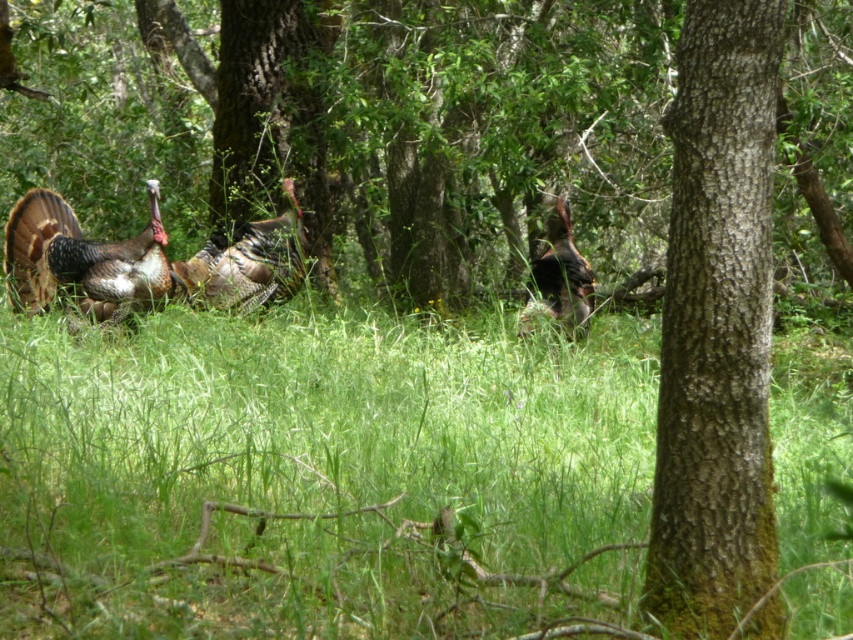
You are a nature photographer aiming to capture the shiny brown turkey at left in the center of your photo. Given its current position at point 0.406 on the x and 0.096 on the y axis, will you need to adjust your camera to the left or right to center it?

The shiny brown turkey at left is positioned at point 0.406 on the x axis and 0.096 on the y axis. To center it in the photo, you would need to adjust the camera to the right, as the x coordinate is less than 0.5, indicating it is to the left of the center. The y coordinate is also below the center, so you might need to adjust upwards slightly as well.

You are a hiker trying to take a photo of the shiny metallic turkey at center. However, the green rough bark tree at center is blocking your view. Can you move around to the left or right to get a clear shot?

The green rough bark tree at center is in front of the shiny metallic turkey at center, so moving to the left or right might allow you to see around the tree and get a clear view of the shiny metallic turkey at center.

You are a photographer standing in the forest scene with the shiny brown turkey at left. You want to take a photo of the turkey but need to stay at least 25 feet away to avoid disturbing it. Can you safely take the photo from your current position?

The distance between you and the shiny brown turkey at left is 24.59 feet, which is less than the required 25 feet. Therefore, you cannot safely take the photo without potentially disturbing the turkey.